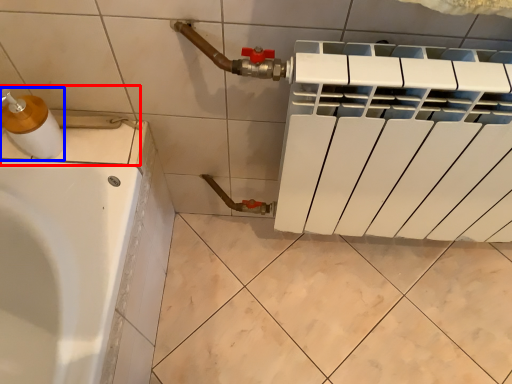
Question: Which point is further to the camera, sink (highlighted by a red box) or soap dispenser (highlighted by a blue box)?

Choices:
 (A) sink
 (B) soap dispenser

Answer: (A)